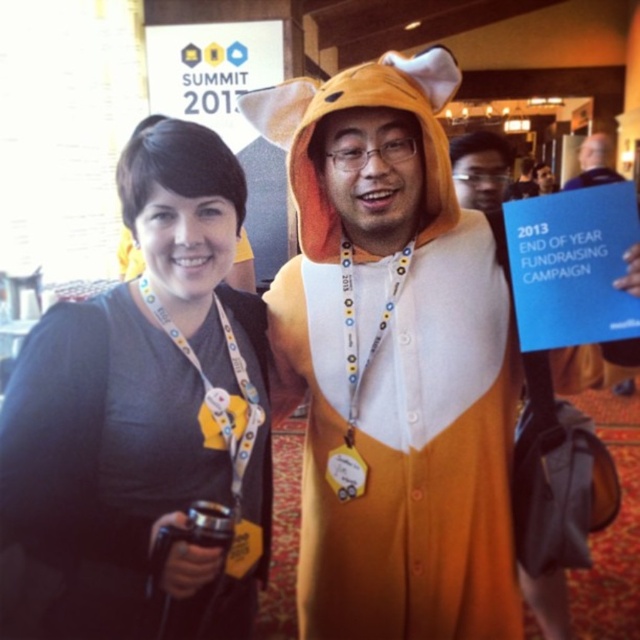
Question: Does orange plush onesie at center have a smaller size compared to black fabric shirt at center?

Choices:
 (A) no
 (B) yes

Answer: (A)

Question: Which of the following is the farthest from the observer?

Choices:
 (A) blue fabric shirt at upper right
 (B) orange plush onesie at center
 (C) black fabric shirt at center

Answer: (A)

Question: Which of the following is the farthest from the observer?

Choices:
 (A) (188, 451)
 (B) (609, 157)
 (C) (336, 332)

Answer: (B)

Question: Is black fabric shirt at center smaller than blue fabric shirt at upper right?

Choices:
 (A) yes
 (B) no

Answer: (A)

Question: Among these objects, which one is farthest from the camera?

Choices:
 (A) orange plush onesie at center
 (B) black fabric shirt at center
 (C) blue fabric shirt at upper right

Answer: (C)

Question: Is black fabric shirt at center positioned in front of blue fabric shirt at upper right?

Choices:
 (A) no
 (B) yes

Answer: (B)